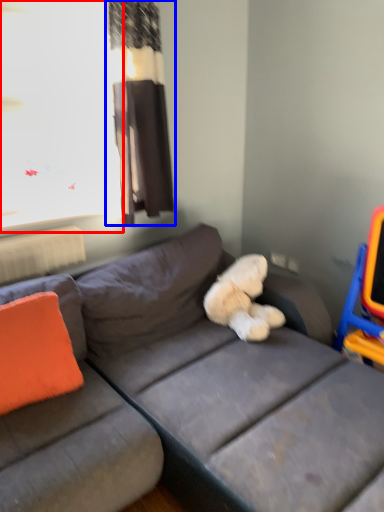
Question: Which object is further to the camera taking this photo, window screen (highlighted by a red box) or curtain (highlighted by a blue box)?

Choices:
 (A) window screen
 (B) curtain

Answer: (B)